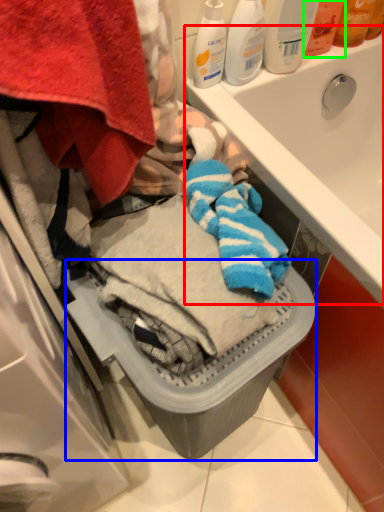
Question: Which object is the farthest from sink (highlighted by a red box)? Choose among these: dish washer (highlighted by a blue box) or toiletry (highlighted by a green box).

Choices:
 (A) dish washer
 (B) toiletry

Answer: (A)